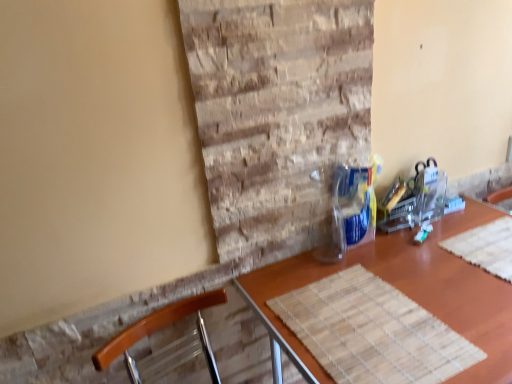
Measure the distance between wooden chair at lower left and camera.

The distance of wooden chair at lower left from camera is 3.29 feet.

Locate an element on the screen. The height and width of the screenshot is (384, 512). wooden chair at lower left is located at coordinates (158, 329).

What do you see at coordinates (158, 329) in the screenshot? The width and height of the screenshot is (512, 384). I see `wooden chair at lower left` at bounding box center [158, 329].

The width and height of the screenshot is (512, 384). Describe the element at coordinates (405, 292) in the screenshot. I see `wooden placemat at center` at that location.

What is the approximate height of wooden placemat at center?

It is 82.99 centimeters.

I want to click on wooden placemat at center, so click(x=405, y=292).

Locate an element on the screen. The height and width of the screenshot is (384, 512). wooden chair at lower left is located at coordinates (158, 329).

Which is more to the right, wooden chair at lower left or wooden placemat at center?

wooden placemat at center.

Based on the photo, considering the positions of objects wooden chair at lower left and wooden placemat at center in the image provided, who is behind, wooden chair at lower left or wooden placemat at center?

Positioned behind is wooden placemat at center.

Considering the positions of point (182, 316) and point (435, 280), is point (182, 316) closer or farther from the camera than point (435, 280)?

Clearly, point (182, 316) is more distant from the camera than point (435, 280).

From the image's perspective, is wooden chair at lower left above or below wooden placemat at center?

wooden chair at lower left is situated higher than wooden placemat at center in the image.

From a real-world perspective, between wooden chair at lower left and wooden placemat at center, who is vertically higher?

From a 3D spatial view, wooden chair at lower left is above.

Looking at their sizes, would you say wooden chair at lower left is wider or thinner than wooden placemat at center?

Considering their sizes, wooden chair at lower left looks slimmer than wooden placemat at center.

Between wooden chair at lower left and wooden placemat at center, which one has less height?

Standing shorter between the two is wooden chair at lower left.

Is wooden chair at lower left bigger than wooden placemat at center?

Actually, wooden chair at lower left might be smaller than wooden placemat at center.

Is wooden chair at lower left situated inside wooden placemat at center or outside?

wooden chair at lower left exists outside the volume of wooden placemat at center.

Is wooden chair at lower left placed right next to wooden placemat at center?

wooden chair at lower left is not next to wooden placemat at center, and they're not touching.

Is wooden chair at lower left aimed at wooden placemat at center?

No, wooden chair at lower left is not aimed at wooden placemat at center.

Can you tell me how much wooden chair at lower left and wooden placemat at center differ in facing direction?

7.08 degrees separate the facing orientations of wooden chair at lower left and wooden placemat at center.

Measure the distance from wooden chair at lower left to wooden placemat at center.

wooden chair at lower left and wooden placemat at center are 15.48 inches apart.

At what (x,y) coordinates should I click in order to perform the action: click on table below the wooden chair at lower left (from the image's perspective). Please return your answer as a coordinate pair (x, y). Looking at the image, I should click on (405, 292).

Does wooden placemat at center appear on the right side of wooden chair at lower left?

Yes.

Does wooden placemat at center lie in front of wooden chair at lower left?

No, the depth of wooden placemat at center is greater than that of wooden chair at lower left.

Between point (474, 334) and point (218, 296), which one is positioned in front?

The point (474, 334) is closer to the camera.

From the image's perspective, which is above, wooden placemat at center or wooden chair at lower left?

wooden chair at lower left.

From a real-world perspective, which is physically above, wooden placemat at center or wooden chair at lower left?

wooden chair at lower left is physically above.

Considering the sizes of objects wooden placemat at center and wooden chair at lower left in the image provided, who is thinner, wooden placemat at center or wooden chair at lower left?

wooden chair at lower left is thinner.

From their relative heights in the image, would you say wooden placemat at center is taller or shorter than wooden chair at lower left?

Clearly, wooden placemat at center is taller compared to wooden chair at lower left.

Does wooden placemat at center have a larger size compared to wooden chair at lower left?

Indeed, wooden placemat at center has a larger size compared to wooden chair at lower left.

Is wooden placemat at center spatially inside wooden chair at lower left, or outside of it?

wooden placemat at center is not inside wooden chair at lower left, it's outside.

Is wooden placemat at center beside wooden chair at lower left?

No, wooden placemat at center is not beside wooden chair at lower left.

Is wooden chair at lower left at the back of wooden placemat at center?

wooden placemat at center does not have its back to wooden chair at lower left.

How different are the orientations of wooden placemat at center and wooden chair at lower left in degrees?

7.08 degrees.

Image resolution: width=512 pixels, height=384 pixels. Identify the location of chair above the wooden placemat at center (from the image's perspective). (158, 329).

This screenshot has height=384, width=512. I want to click on table below the wooden chair at lower left (from the image's perspective), so click(405, 292).

This screenshot has height=384, width=512. In order to click on table behind the wooden chair at lower left in this screenshot , I will do `click(405, 292)`.